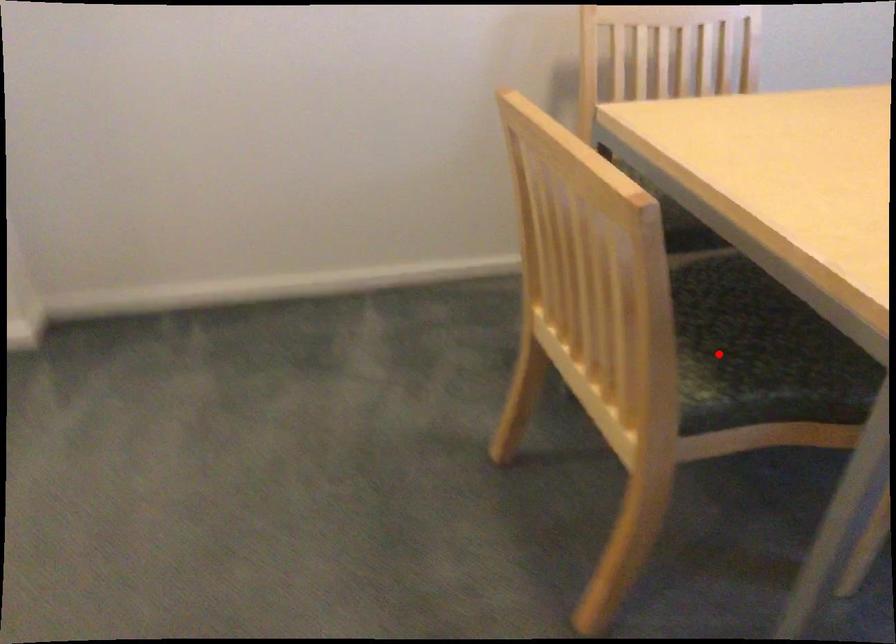
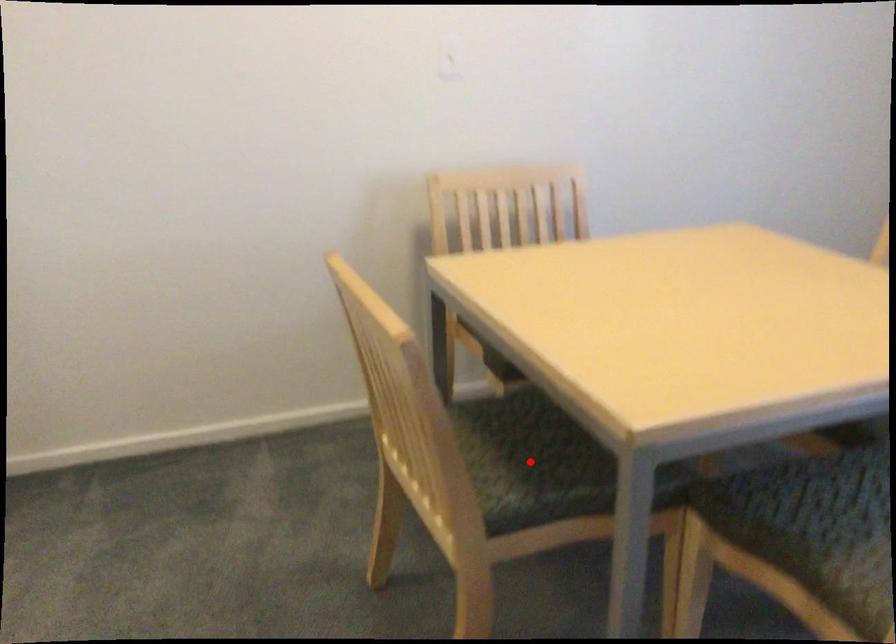
I am providing you with two images of the same scene from different viewpoints. A red point is marked on the first image and another point is marked on the second image. Are the points marked in image1 and image2 representing the same 3D position?

Yes